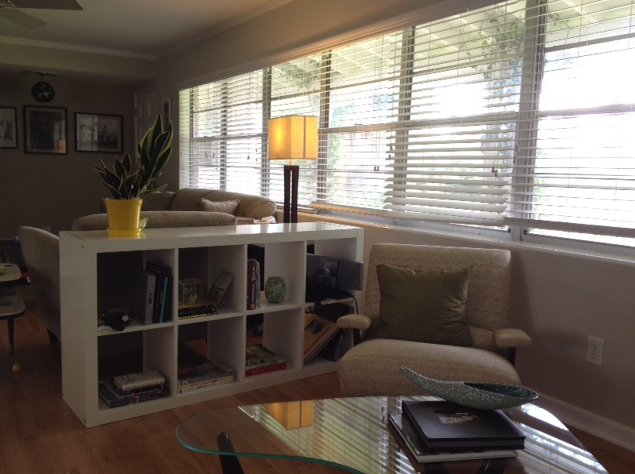
Find the location of a particular element. The width and height of the screenshot is (635, 474). shelves is located at coordinates (134, 326), (155, 397), (190, 387), (221, 315), (277, 307), (324, 300), (275, 374), (324, 363).